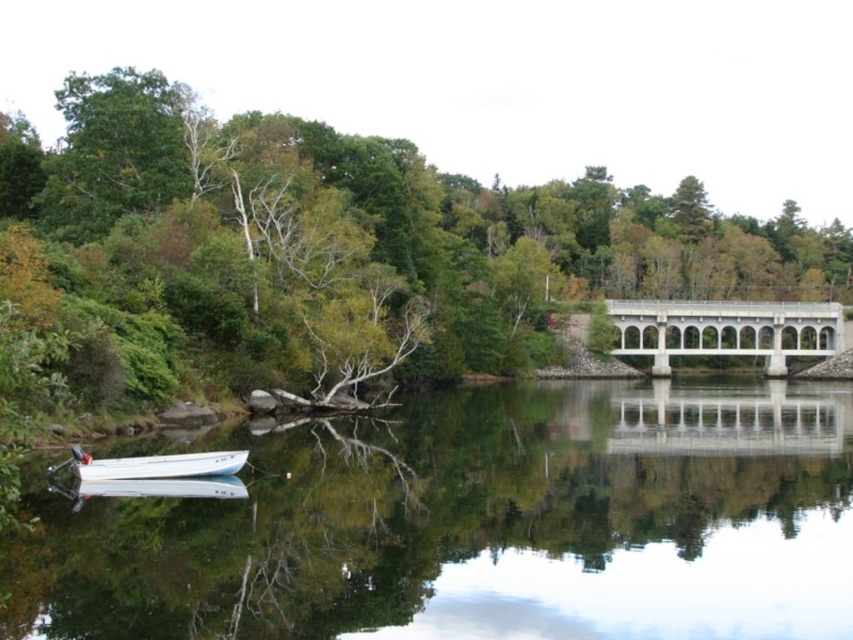
Does green leafy tree at center appear on the left side of white concrete bridge at center?

Correct, you'll find green leafy tree at center to the left of white concrete bridge at center.

Is green leafy tree at center to the right of white concrete bridge at center from the viewer's perspective?

No, green leafy tree at center is not to the right of white concrete bridge at center.

This screenshot has height=640, width=853. In order to click on green leafy tree at center in this screenshot , I will do `click(376, 225)`.

Can you confirm if white concrete bridge at center is wider than white glossy boat at lower left?

Indeed, white concrete bridge at center has a greater width compared to white glossy boat at lower left.

Between white concrete bridge at center and white glossy boat at lower left, which one has less height?

With less height is white glossy boat at lower left.

Between point (727, 348) and point (160, 474), which one is positioned behind?

Point (727, 348)

The image size is (853, 640). Identify the location of white concrete bridge at center. (726, 330).

You are a GUI agent. You are given a task and a screenshot of the screen. Output one action in this format:
    pyautogui.click(x=<x>, y=<y>)
    Task: Click on the clear glass water at center
    This screenshot has height=640, width=853.
    Given the screenshot: What is the action you would take?
    pyautogui.click(x=480, y=525)

What do you see at coordinates (480, 525) in the screenshot? The image size is (853, 640). I see `clear glass water at center` at bounding box center [480, 525].

You are a GUI agent. You are given a task and a screenshot of the screen. Output one action in this format:
    pyautogui.click(x=<x>, y=<y>)
    Task: Click on the clear glass water at center
    The image size is (853, 640).
    Given the screenshot: What is the action you would take?
    pyautogui.click(x=480, y=525)